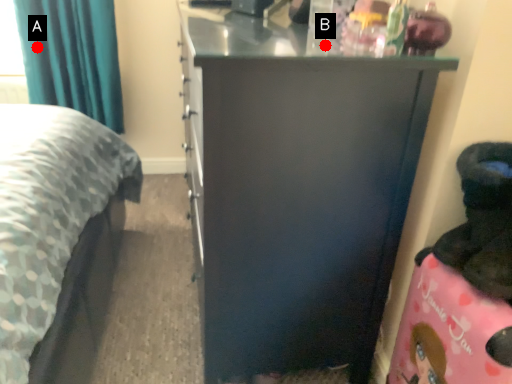
Question: Two points are circled on the image, labeled by A and B beside each circle. Among these points, which one is farthest from the camera?

Choices:
 (A) A is further
 (B) B is further

Answer: (A)